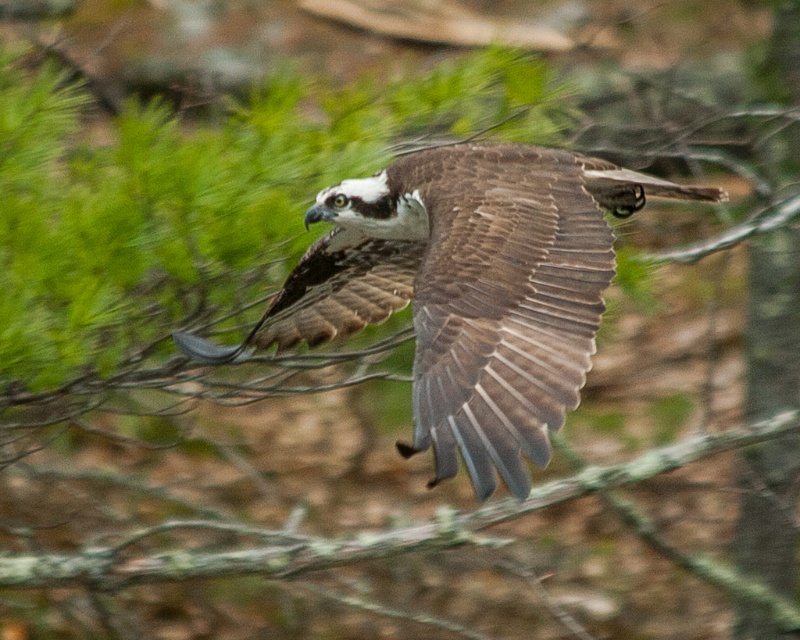
You are a wildlife photographer aiming to capture the osprey in flight. You notice the point at coordinates (500, 301) in the image. Based on the scene, what object does this point correspond to?

The point at coordinates (500, 301) corresponds to the brown feathered wing at center.

You are a wildlife photographer aiming to capture a clear photo of the brown feathered eagle at center and the green mossy branch at center. Your camera has a maximum focus range of 40 feet. Can you focus on both subjects simultaneously?

The brown feathered eagle at center is 40.52 feet from the green mossy branch at center. Since the distance between them exceeds the camera maximum focus range of 40 feet, you cannot focus on both subjects simultaneously.

You are observing an osprey in flight. You notice two points marked on the image at coordinates point [440,413] and point [676,452]. Which of these points is located closer to your viewpoint?

Point [440,413] is closer to the viewer than point [676,452].